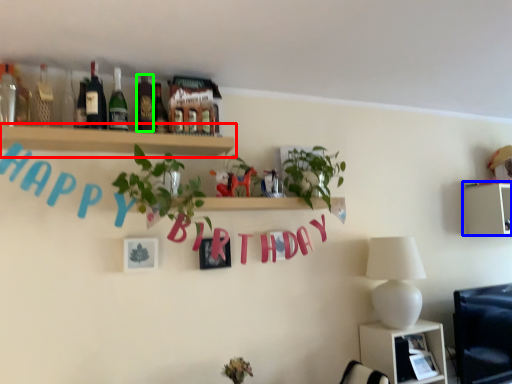
Question: Based on their relative distances, which object is farther from shelf (highlighted by a red box)? Choose from shelf (highlighted by a blue box) and bottle (highlighted by a green box).

Choices:
 (A) shelf
 (B) bottle

Answer: (A)